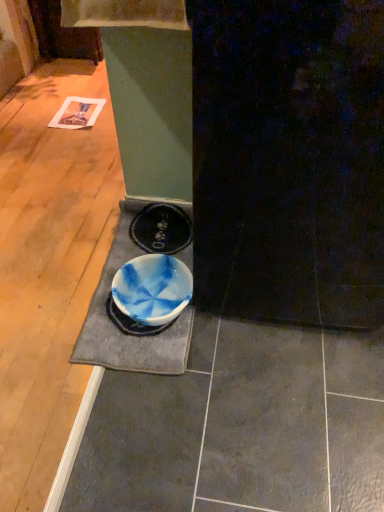
Identify the location of vacant space that is to the left of blue marbled bowl at center. The height and width of the screenshot is (512, 384). (60, 303).